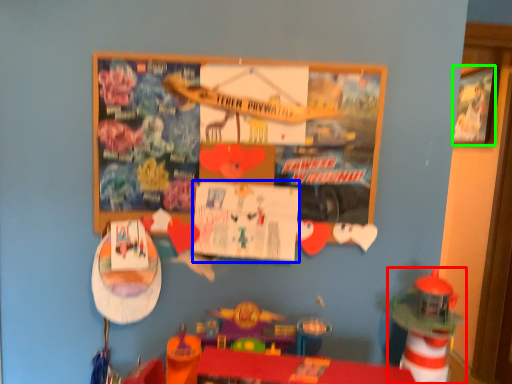
Question: Which object is positioned closest to toy (highlighted by a red box)? Select from poster page (highlighted by a blue box) and picture frame (highlighted by a green box).

Choices:
 (A) poster page
 (B) picture frame

Answer: (A)